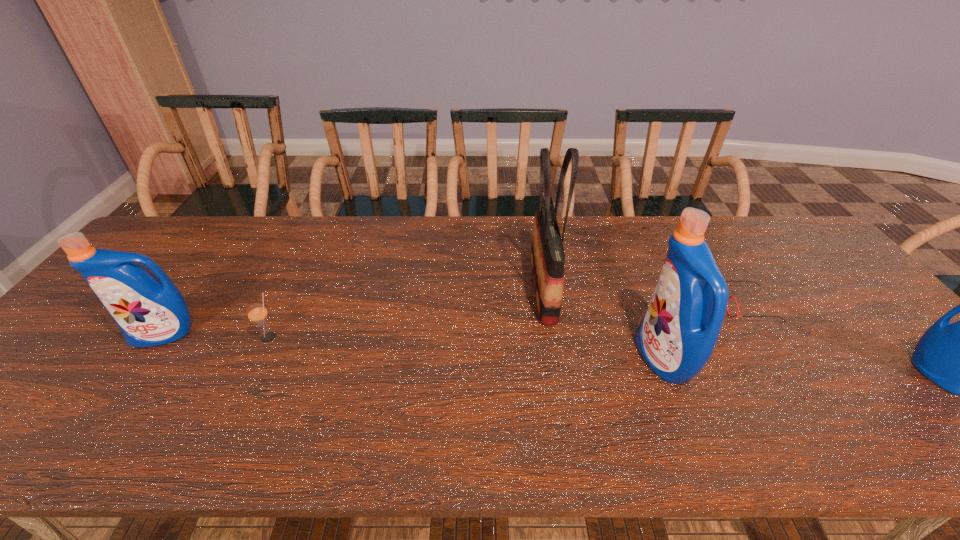
At what (x,y) coordinates should I click in order to perform the action: click on blank space located 0.280m on the label of the fourth object from left to right. Please return your answer as a coordinate pair (x, y). This screenshot has width=960, height=540. Looking at the image, I should click on (524, 360).

Where is `free space located 0.130m on the label of the fourth object from left to right`? This screenshot has height=540, width=960. free space located 0.130m on the label of the fourth object from left to right is located at coordinates (587, 360).

Identify the location of vacant space located 0.290m on the label of the fourth object from left to right. This screenshot has width=960, height=540. (520, 360).

I want to click on vacant space positioned 0.090m on the front-facing side of the shortest object, so click(x=689, y=306).

Where is `free point located 0.360m on the front-facing side of the shortest object`? The height and width of the screenshot is (540, 960). free point located 0.360m on the front-facing side of the shortest object is located at coordinates 590,306.

Where is `free region located 0.250m on the front-facing side of the shortest object`? free region located 0.250m on the front-facing side of the shortest object is located at coordinates (631, 306).

The height and width of the screenshot is (540, 960). Identify the location of free space located 0.280m on the front-facing side of the shopping bag. (430, 287).

The image size is (960, 540). In order to click on free region located on the front-facing side of the shopping bag in this screenshot , I will do `click(511, 287)`.

In order to click on vacant space located 0.130m on the front-facing side of the shopping bag in this screenshot , I will do `click(483, 287)`.

Where is `vacant area situated on the left of the straw`? vacant area situated on the left of the straw is located at coordinates pos(224,338).